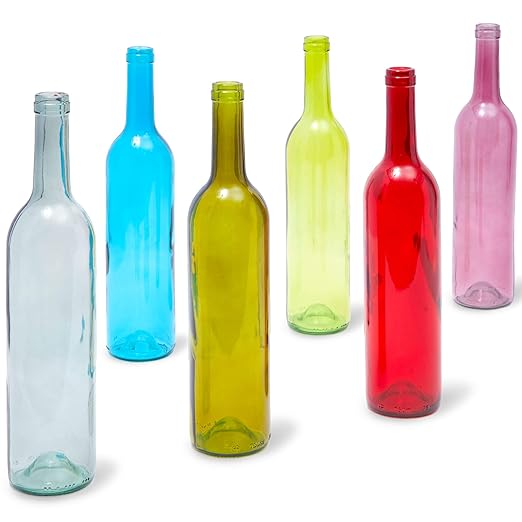
Identify the location of colored clear glass bottles. (49, 309), (155, 246), (229, 300), (310, 223), (390, 272), (472, 219).